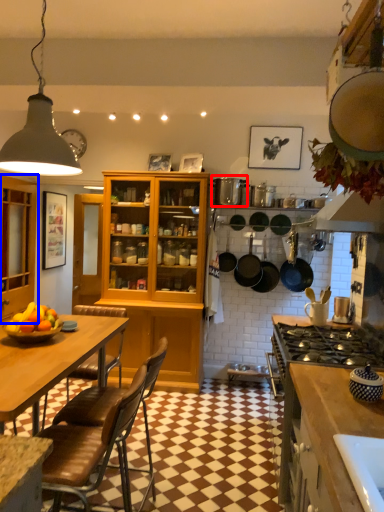
Question: Which object is further to the camera taking this photo, appliance (highlighted by a red box) or cabinetry (highlighted by a blue box)?

Choices:
 (A) appliance
 (B) cabinetry

Answer: (A)